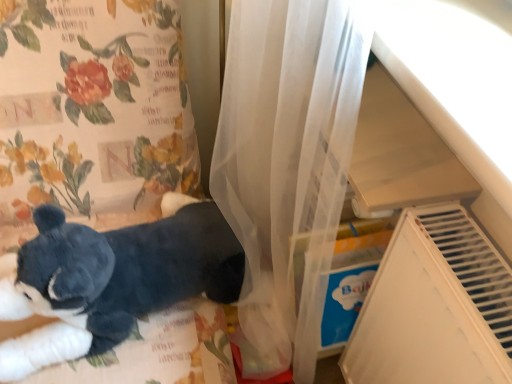
Describe the element at coordinates (112, 279) in the screenshot. I see `soft plush dog at lower left` at that location.

Identify the location of soft plush dog at lower left. (112, 279).

Locate an element on the screen. soft plush dog at lower left is located at coordinates (112, 279).